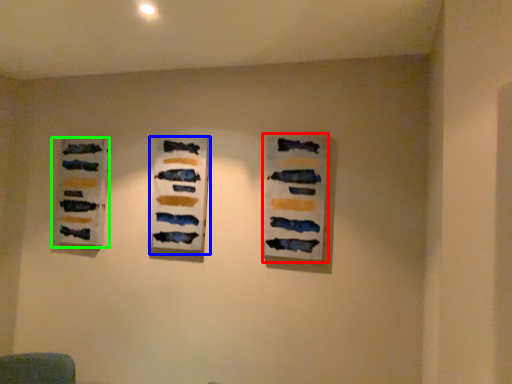
Question: Estimate the real-world distances between objects in this image. Which object is farther from art exhibition (highlighted by a red box), art exhibition (highlighted by a blue box) or art exhibition (highlighted by a green box)?

Choices:
 (A) art exhibition
 (B) art exhibition

Answer: (B)